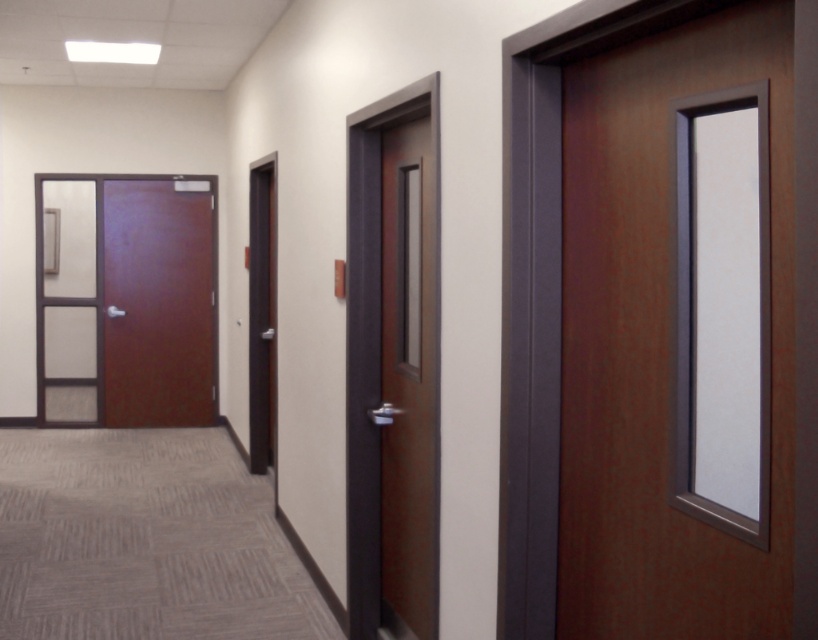
Who is higher up, brown wood door at left or brown wood door at center?

brown wood door at left

How much distance is there between brown wood door at left and brown wood door at center?

brown wood door at left and brown wood door at center are 5.23 meters apart from each other.

Is point (70, 371) closer to camera compared to point (403, 545)?

No, it is not.

You are a GUI agent. You are given a task and a screenshot of the screen. Output one action in this format:
    pyautogui.click(x=<x>, y=<y>)
    Task: Click on the brown wood door at left
    The width and height of the screenshot is (818, 640).
    Given the screenshot: What is the action you would take?
    pos(126,300)